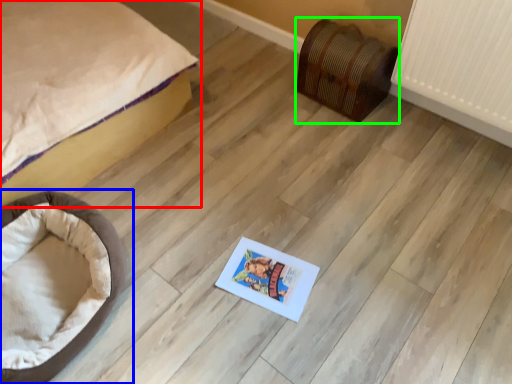
Question: Estimate the real-world distances between objects in this image. Which object is farther from bed (highlighted by a red box), dog bed (highlighted by a blue box) or furniture (highlighted by a green box)?

Choices:
 (A) dog bed
 (B) furniture

Answer: (B)